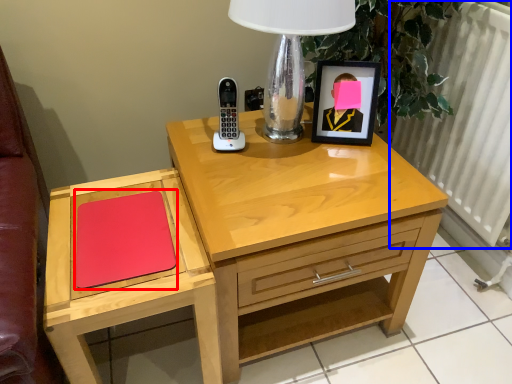
Question: Which object appears closest to the camera in this image, notepad (highlighted by a red box) or radiator (highlighted by a blue box)?

Choices:
 (A) notepad
 (B) radiator

Answer: (A)